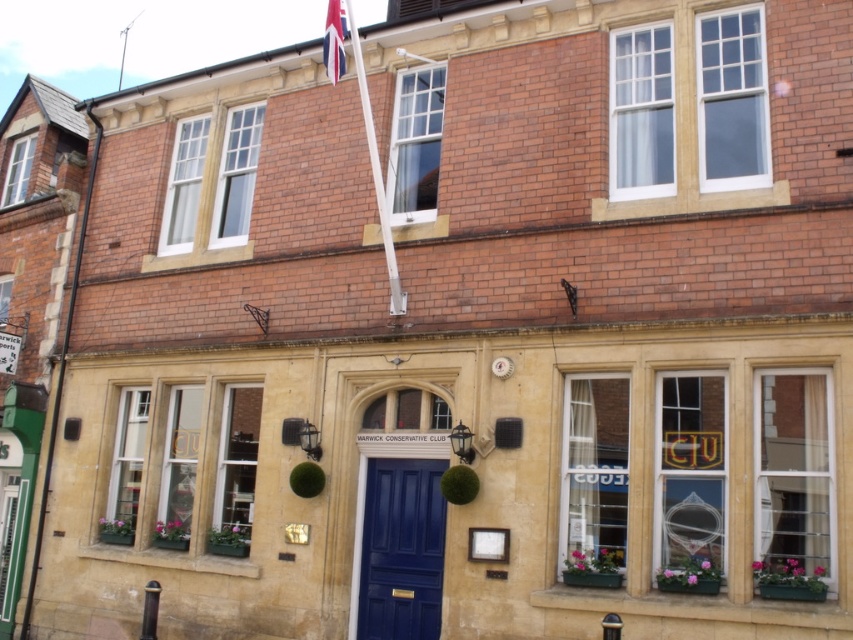
Question: Is shiny blue door at center wider than red fabric flag at upper center?

Choices:
 (A) no
 (B) yes

Answer: (B)

Question: Among these objects, which one is nearest to the camera?

Choices:
 (A) red fabric flag at upper center
 (B) shiny blue door at center

Answer: (A)

Question: Among these objects, which one is nearest to the camera?

Choices:
 (A) red fabric flag at upper center
 (B) shiny blue door at center

Answer: (A)

Question: Is shiny blue door at center to the right of red fabric flag at upper center from the viewer's perspective?

Choices:
 (A) no
 (B) yes

Answer: (B)

Question: Is shiny blue door at center behind red fabric flag at upper center?

Choices:
 (A) no
 (B) yes

Answer: (B)

Question: Which point is closer to the camera taking this photo?

Choices:
 (A) (364, 502)
 (B) (326, 36)

Answer: (B)